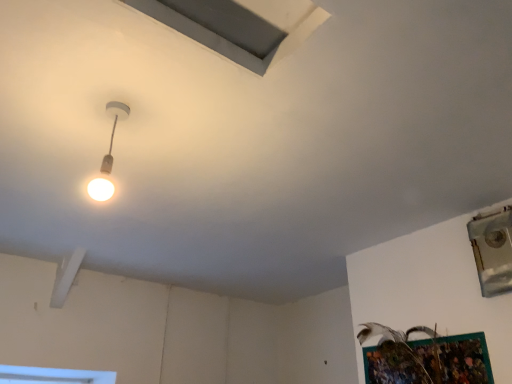
Question: Is metallic silver window at upper right smaller than matte white lamp at upper left?

Choices:
 (A) yes
 (B) no

Answer: (B)

Question: Is metallic silver window at upper right looking in the opposite direction of matte white lamp at upper left?

Choices:
 (A) yes
 (B) no

Answer: (B)

Question: From the image's perspective, does metallic silver window at upper right appear lower than matte white lamp at upper left?

Choices:
 (A) yes
 (B) no

Answer: (A)

Question: Is metallic silver window at upper right next to matte white lamp at upper left?

Choices:
 (A) yes
 (B) no

Answer: (B)

Question: From the image's perspective, is metallic silver window at upper right located above matte white lamp at upper left?

Choices:
 (A) yes
 (B) no

Answer: (B)

Question: Considering the relative positions of metallic silver window at upper right and matte white lamp at upper left in the image provided, is metallic silver window at upper right to the left of matte white lamp at upper left from the viewer's perspective?

Choices:
 (A) yes
 (B) no

Answer: (B)

Question: Considering the relative sizes of matte white lamp at upper left and gray matte exhaust hood at upper center in the image provided, is matte white lamp at upper left wider than gray matte exhaust hood at upper center?

Choices:
 (A) no
 (B) yes

Answer: (A)

Question: From a real-world perspective, does matte white lamp at upper left stand above gray matte exhaust hood at upper center?

Choices:
 (A) yes
 (B) no

Answer: (B)

Question: Does matte white lamp at upper left appear on the left side of gray matte exhaust hood at upper center?

Choices:
 (A) no
 (B) yes

Answer: (B)

Question: Is matte white lamp at upper left with gray matte exhaust hood at upper center?

Choices:
 (A) yes
 (B) no

Answer: (B)

Question: Is matte white lamp at upper left located outside gray matte exhaust hood at upper center?

Choices:
 (A) yes
 (B) no

Answer: (A)

Question: Does matte white lamp at upper left come behind gray matte exhaust hood at upper center?

Choices:
 (A) no
 (B) yes

Answer: (B)

Question: Is gray matte exhaust hood at upper center with metallic silver window at upper right?

Choices:
 (A) yes
 (B) no

Answer: (B)